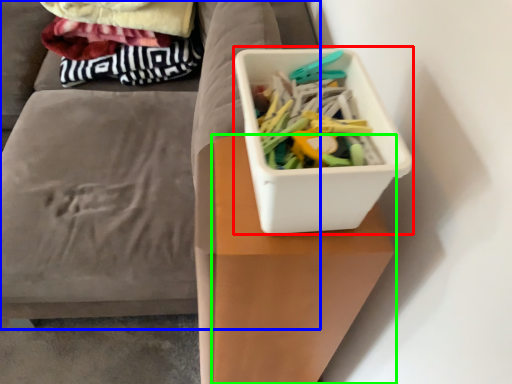
Question: Which object is positioned closest to storage box (highlighted by a red box)? Select from furniture (highlighted by a blue box) and table (highlighted by a green box).

Choices:
 (A) furniture
 (B) table

Answer: (B)